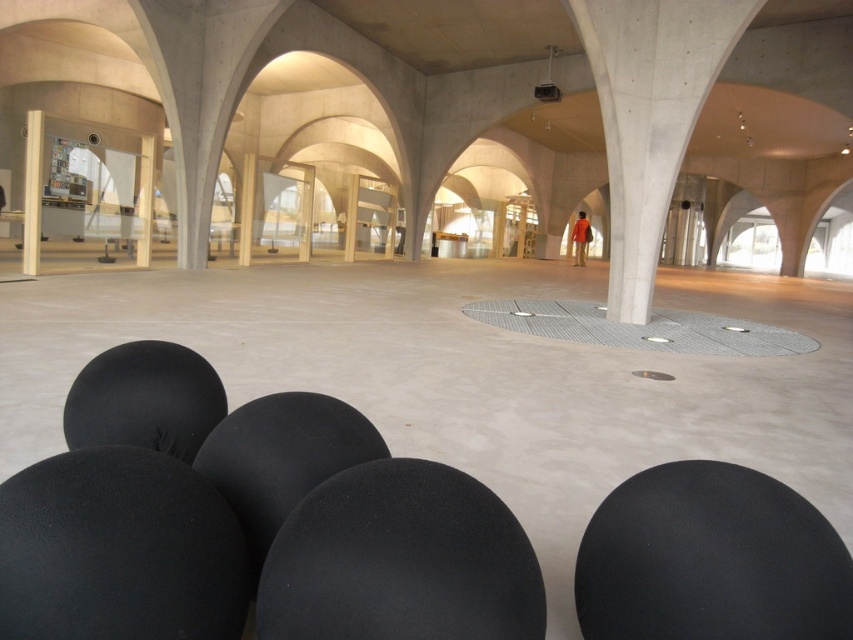
Question: Considering the relative positions of matte concrete pillar at center and matte gray pillar at center in the image provided, where is matte concrete pillar at center located with respect to matte gray pillar at center?

Choices:
 (A) left
 (B) right

Answer: (A)

Question: Which object is positioned farthest from the matte white pillar at center?

Choices:
 (A) matte concrete pillar at center
 (B) white smooth pillar at left
 (C) matte gray pillar at center

Answer: (C)

Question: Is matte white pillar at center closer to camera compared to matte gray pillar at center?

Choices:
 (A) yes
 (B) no

Answer: (A)

Question: Which point appears farthest from the camera in this image?

Choices:
 (A) (352, 176)
 (B) (149, 141)
 (C) (36, 246)
 (D) (250, 228)

Answer: (A)

Question: Can you confirm if matte white pillar at center is positioned above matte gray pillar at center?

Choices:
 (A) yes
 (B) no

Answer: (B)

Question: Which point is closer to the camera?

Choices:
 (A) (254, 163)
 (B) (148, 192)

Answer: (B)